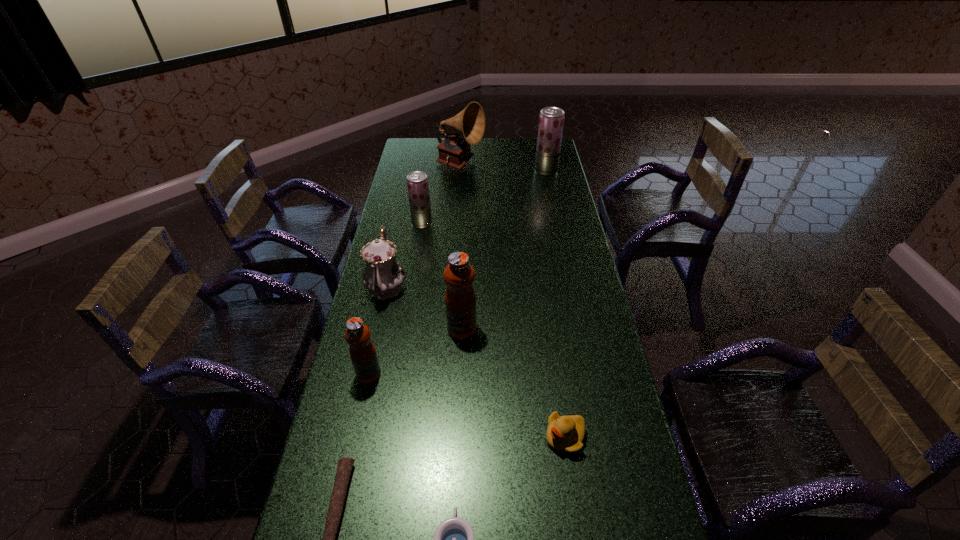
I want to click on phonograph record, so click(x=454, y=151).

What are the coordinates of `the right strawberry fruit juice` in the screenshot? It's located at (551, 120).

In order to click on the farthest fruit juice in this screenshot , I will do `click(551, 120)`.

This screenshot has height=540, width=960. What are the coordinates of `the right orange fruit juice` in the screenshot? It's located at (460, 299).

Find the location of `the third farthest fruit juice`. the third farthest fruit juice is located at coordinates click(x=460, y=299).

I want to click on the smaller strawberry fruit juice, so click(417, 182).

Image resolution: width=960 pixels, height=540 pixels. In order to click on the nearer strawberry fruit juice in this screenshot , I will do click(417, 182).

Locate an element on the screen. This screenshot has height=540, width=960. the leftmost fruit juice is located at coordinates pyautogui.click(x=362, y=351).

Locate an element on the screen. The height and width of the screenshot is (540, 960). the sixth farthest object is located at coordinates (362, 351).

The height and width of the screenshot is (540, 960). I want to click on the sixth nearest object, so click(x=383, y=276).